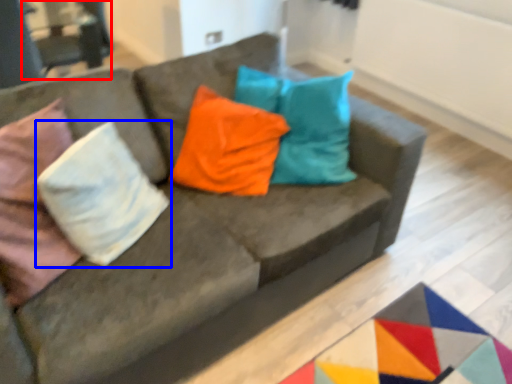
Question: Which point is further to the camera, armchair (highlighted by a red box) or pillow (highlighted by a blue box)?

Choices:
 (A) armchair
 (B) pillow

Answer: (A)